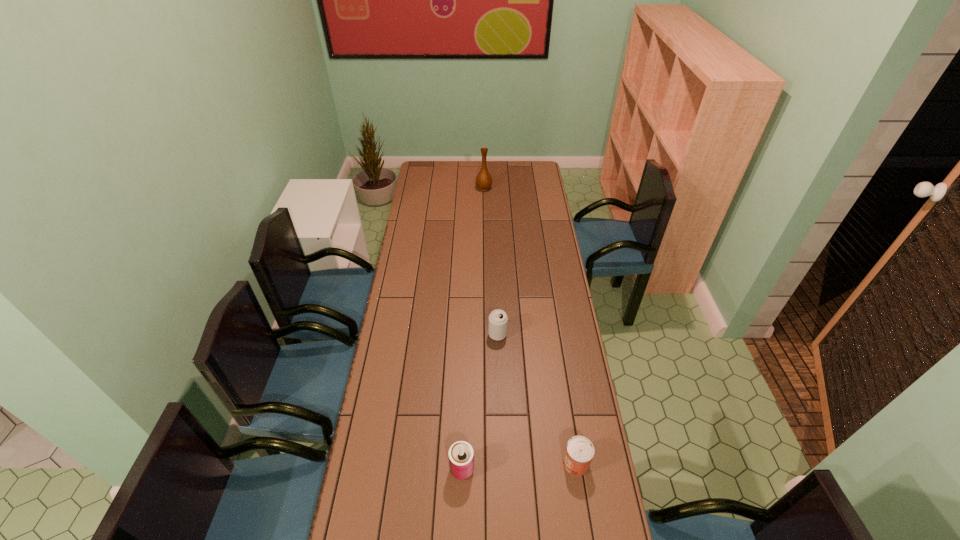
Locate an element on the screen. The width and height of the screenshot is (960, 540). object that is at the right edge is located at coordinates (579, 452).

The height and width of the screenshot is (540, 960). What are the coordinates of `vacant area at the far edge of the desktop` in the screenshot? It's located at (447, 181).

You are a GUI agent. You are given a task and a screenshot of the screen. Output one action in this format:
    pyautogui.click(x=<x>, y=<y>)
    Task: Click on the vacant space at the left edge of the desktop
    
    Given the screenshot: What is the action you would take?
    pyautogui.click(x=427, y=199)

In the image, there is a desktop. Where is `blank space at the right edge`? The height and width of the screenshot is (540, 960). blank space at the right edge is located at coordinates (562, 402).

Locate an element on the screen. This screenshot has height=540, width=960. empty space that is in between the leftmost can and the tallest object is located at coordinates (473, 329).

At what (x,y) coordinates should I click in order to perform the action: click on vacant space that's between the leftmost can and the tallest object. Please return your answer as a coordinate pair (x, y). The width and height of the screenshot is (960, 540). Looking at the image, I should click on (473, 329).

Find the location of `free space between the second farthest object and the rightmost object`. free space between the second farthest object and the rightmost object is located at coordinates (537, 399).

Identify the location of empty space that is in between the vase and the leftmost can. The height and width of the screenshot is (540, 960). (473, 329).

The height and width of the screenshot is (540, 960). I want to click on free space between the tallest object and the farthest can, so click(x=491, y=261).

You are a GUI agent. You are given a task and a screenshot of the screen. Output one action in this format:
    pyautogui.click(x=<x>, y=<y>)
    Task: Click on the empty space between the second can from left to right and the farthest object
    The width and height of the screenshot is (960, 540).
    Given the screenshot: What is the action you would take?
    pyautogui.click(x=491, y=261)